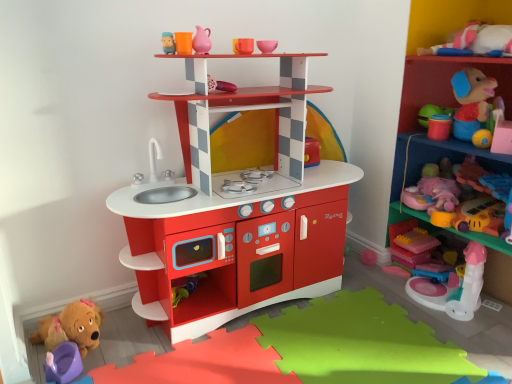
Identify the location of vacant area that lies to the right of brown plush dog at lower left, which is the ninth toy in right-to-left order. (129, 349).